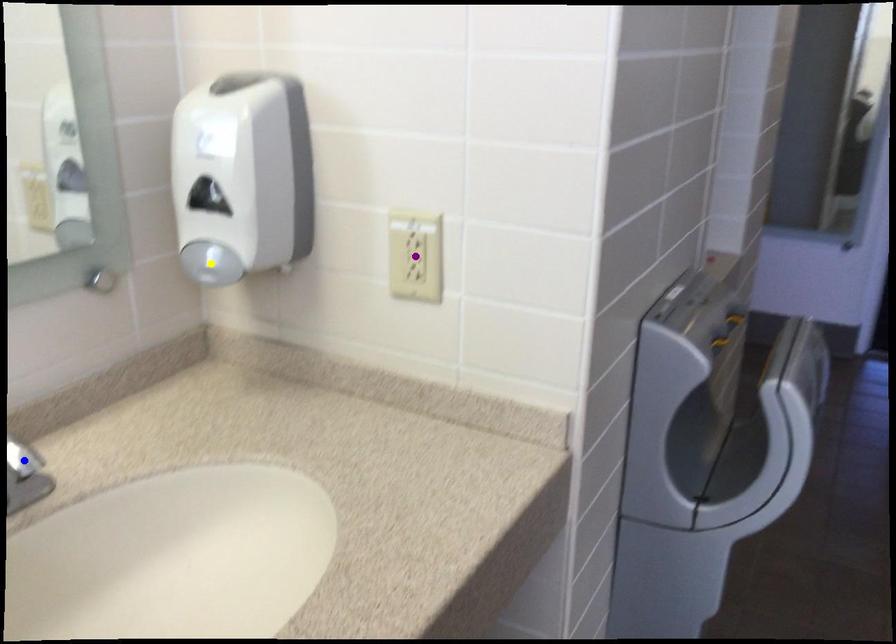
Order these from farthest to nearest:
blue point
purple point
yellow point

yellow point → purple point → blue point